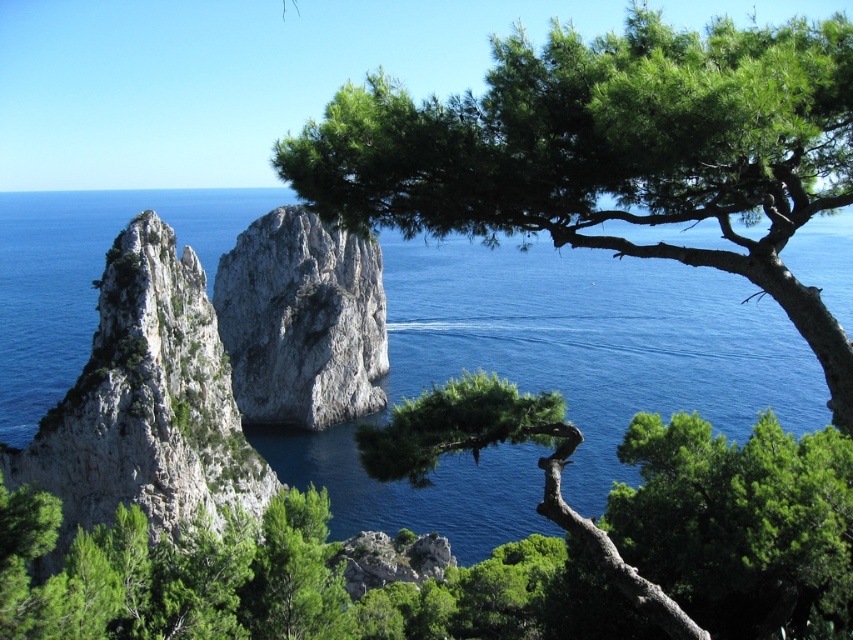
Question: Which of the following is the closest to the observer?

Choices:
 (A) white rocky cliff at center
 (B) white rocky cliff at left

Answer: (B)

Question: Is white rocky cliff at left smaller than white rocky cliff at center?

Choices:
 (A) yes
 (B) no

Answer: (A)

Question: Does white rocky cliff at left appear on the left side of white rocky cliff at center?

Choices:
 (A) yes
 (B) no

Answer: (A)

Question: Which point is farther to the camera?

Choices:
 (A) (160, 298)
 (B) (347, 269)

Answer: (B)

Question: Can you confirm if white rocky cliff at left is thinner than white rocky cliff at center?

Choices:
 (A) no
 (B) yes

Answer: (B)